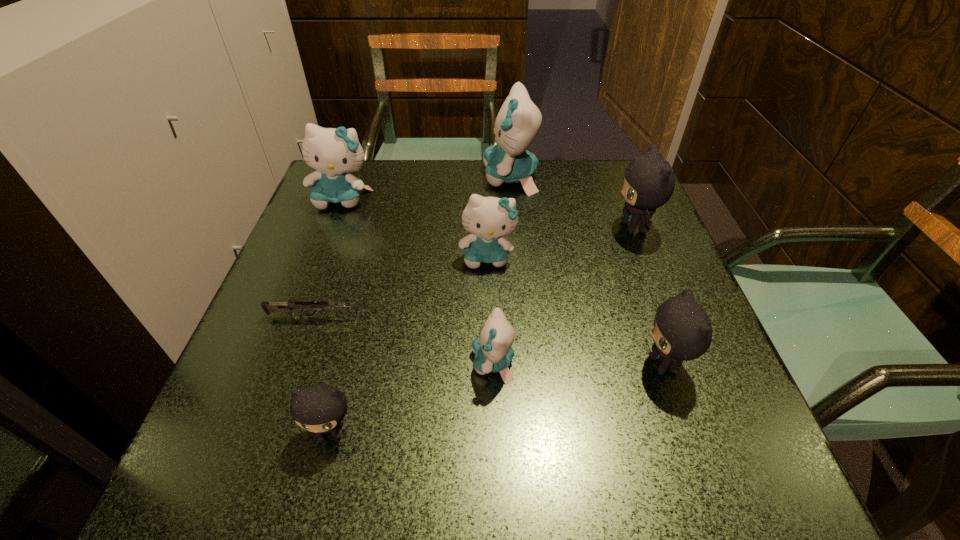
Identify the location of object located at the far right corner. Image resolution: width=960 pixels, height=540 pixels. (649, 181).

Find the location of a particular element. The image size is (960, 540). blank space at the far edge of the desktop is located at coordinates (420, 185).

What are the coordinates of `free space at the near edge of the desktop` in the screenshot? It's located at (403, 467).

This screenshot has width=960, height=540. I want to click on free space at the left edge of the desktop, so click(x=239, y=414).

Find the location of a particular element. This screenshot has height=540, width=960. blank space at the right edge is located at coordinates (619, 230).

Where is `free space at the far left corner of the desktop`? This screenshot has height=540, width=960. free space at the far left corner of the desktop is located at coordinates (370, 185).

Identify the location of free space at the far right corner. The width and height of the screenshot is (960, 540). (580, 179).

Identify the location of unoccupied position between the third farthest blue kitten and the nearest blue kitten. This screenshot has width=960, height=540. (491, 310).

At what (x,y) coordinates should I click in order to perform the action: click on empty location between the biggest blue kitten and the leftmost blue kitten. Please return your answer as a coordinate pair (x, y). This screenshot has height=540, width=960. Looking at the image, I should click on (426, 188).

Find the location of `unoccupied area between the third biggest blue kitten and the second farthest gray kitten`. unoccupied area between the third biggest blue kitten and the second farthest gray kitten is located at coordinates (576, 310).